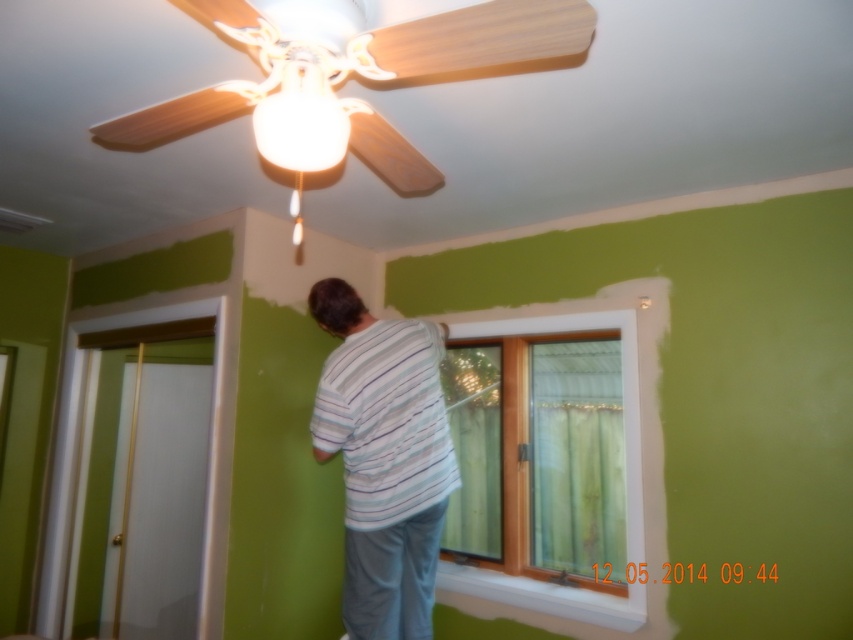
You are a painter in the room and need to hang a picture frame on the wall between the green sheer curtain at window and the white wooden window at center. Which object should you place the frame closer to if you want it to be illuminated by the ceiling fan light?

The green sheer curtain at window is to the right of the white wooden window at center. Since the ceiling fan light is casting a warm glow over the room, placing the picture frame closer to the white wooden window at center would ensure better illumination as it is positioned under the light source.

You are planning to replace the green sheer curtain at window with a new one that is taller. Based on the current setup, will the new taller curtain reach the bottom of the white wooden window at center?

The green sheer curtain at window is currently not as tall as the white wooden window at center, so if the new curtain is made taller than the existing one, it should reach the bottom of the white wooden window at center.

You are a painter who needs to hang a decorative tapestry between the green sheer curtain at window and the white wooden window at center. The tapestry is 9 inches wide. Do you think it will fit in the space between them?

The distance between the green sheer curtain at window and the white wooden window at center is 8.98 inches. Since the tapestry is 9 inches wide, it would not fit as the space is slightly narrower than the tapestry.